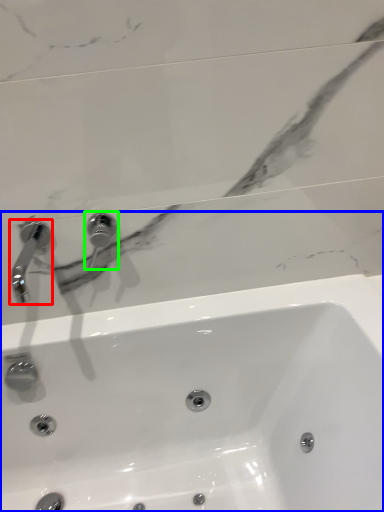
Question: Which object is the closest to the tap (highlighted by a red box)? Choose among these: sink (highlighted by a blue box) or tap (highlighted by a green box).

Choices:
 (A) sink
 (B) tap

Answer: (B)